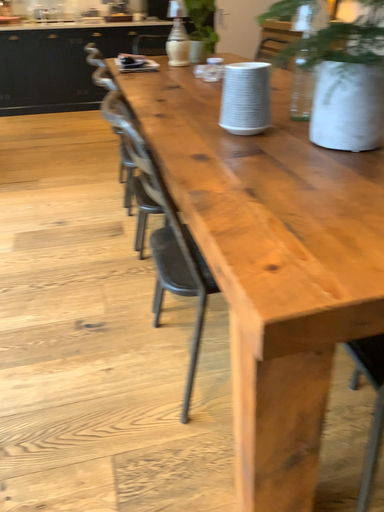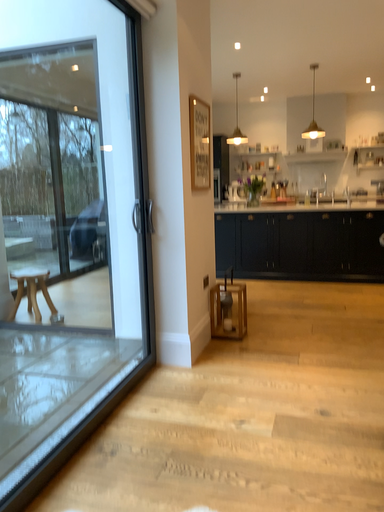
Question: Which way did the camera rotate in the video?

Choices:
 (A) rotated upward
 (B) rotated downward

Answer: (A)